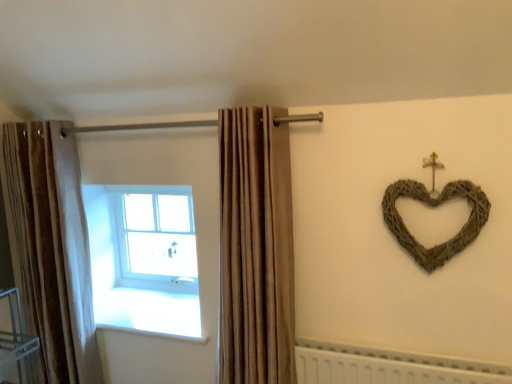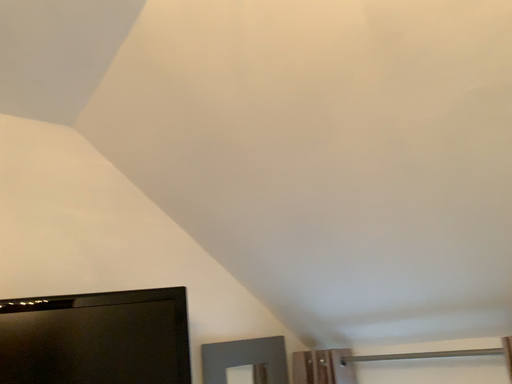
Question: How did the camera likely rotate when shooting the video?

Choices:
 (A) rotated downward
 (B) rotated upward

Answer: (B)